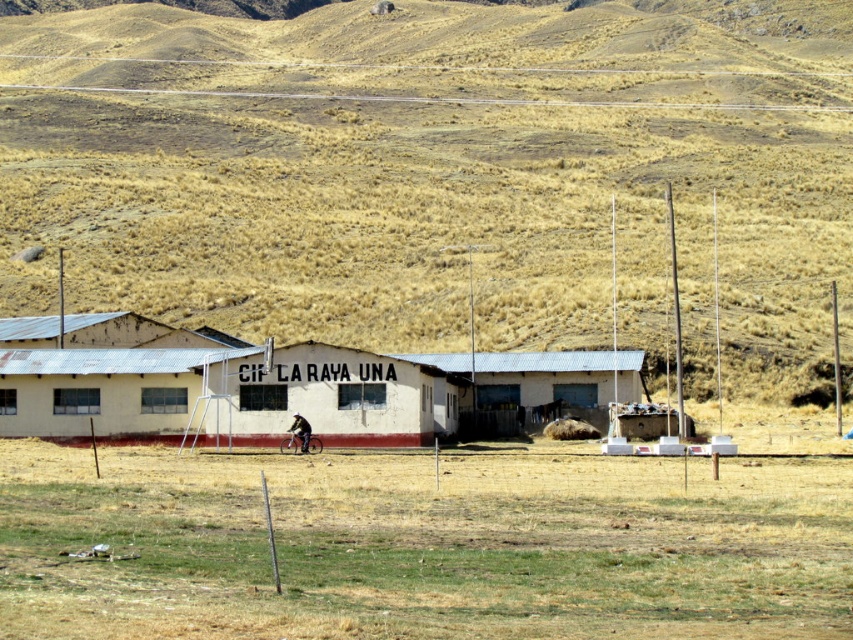
Does brown grassy hillside at upper center appear on the left side of green grass at center?

No, brown grassy hillside at upper center is not to the left of green grass at center.

Does brown grassy hillside at upper center appear under green grass at center?

No.

Who is more forward, (630,65) or (567,588)?

Point (567,588) is in front.

At what (x,y) coordinates should I click in order to perform the action: click on brown grassy hillside at upper center. Please return your answer as a coordinate pair (x, y). This screenshot has height=640, width=853. Looking at the image, I should click on (440, 172).

Looking at this image, can you confirm if green grass at center is smaller than white corrugated metal building at center?

Yes.

Which is more to the right, green grass at center or white corrugated metal building at center?

Positioned to the right is green grass at center.

The height and width of the screenshot is (640, 853). Describe the element at coordinates (421, 545) in the screenshot. I see `green grass at center` at that location.

You are a GUI agent. You are given a task and a screenshot of the screen. Output one action in this format:
    pyautogui.click(x=<x>, y=<y>)
    Task: Click on the green grass at center
    The width and height of the screenshot is (853, 640).
    Given the screenshot: What is the action you would take?
    pyautogui.click(x=421, y=545)

Between brown grassy hillside at upper center and white corrugated metal building at center, which one appears on the left side from the viewer's perspective?

From the viewer's perspective, white corrugated metal building at center appears more on the left side.

The width and height of the screenshot is (853, 640). I want to click on brown grassy hillside at upper center, so click(440, 172).

Locate an element on the screen. The height and width of the screenshot is (640, 853). brown grassy hillside at upper center is located at coordinates (440, 172).